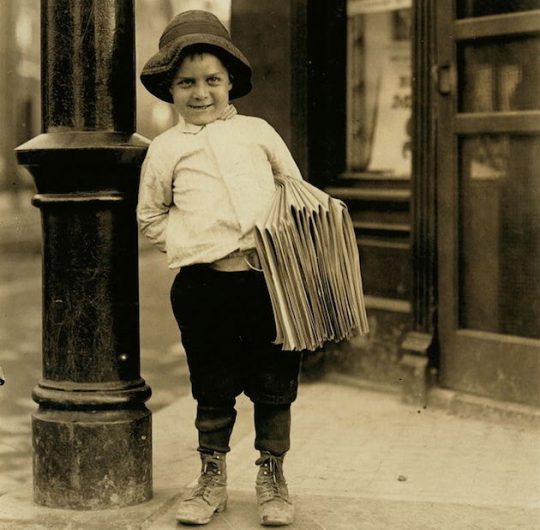
The height and width of the screenshot is (530, 540). In order to click on door in this screenshot , I will do `click(512, 253)`.